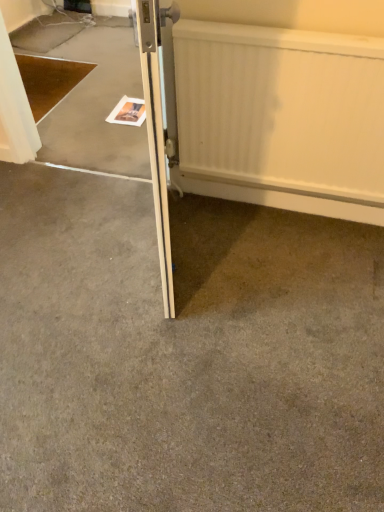
Question: Does gray carpet at center appear on the right side of wooden door at center?

Choices:
 (A) no
 (B) yes

Answer: (A)

Question: Is the position of gray carpet at center less distant than that of wooden door at center?

Choices:
 (A) yes
 (B) no

Answer: (B)

Question: Is gray carpet at center far away from wooden door at center?

Choices:
 (A) yes
 (B) no

Answer: (B)

Question: From the image's perspective, is gray carpet at center located beneath wooden door at center?

Choices:
 (A) no
 (B) yes

Answer: (B)

Question: From the image's perspective, is gray carpet at center over wooden door at center?

Choices:
 (A) no
 (B) yes

Answer: (A)

Question: From a real-world perspective, is gray carpet at center located higher than wooden door at center?

Choices:
 (A) yes
 (B) no

Answer: (B)

Question: Is the position of white textured radiator at upper right less distant than that of wooden door at center?

Choices:
 (A) yes
 (B) no

Answer: (B)

Question: Considering the relative sizes of white textured radiator at upper right and wooden door at center in the image provided, is white textured radiator at upper right taller than wooden door at center?

Choices:
 (A) no
 (B) yes

Answer: (A)

Question: From the image's perspective, would you say white textured radiator at upper right is positioned over wooden door at center?

Choices:
 (A) no
 (B) yes

Answer: (B)

Question: Is white textured radiator at upper right positioned behind wooden door at center?

Choices:
 (A) no
 (B) yes

Answer: (B)

Question: Could you tell me if white textured radiator at upper right is turned towards wooden door at center?

Choices:
 (A) no
 (B) yes

Answer: (B)

Question: Is white textured radiator at upper right not within wooden door at center?

Choices:
 (A) no
 (B) yes

Answer: (B)

Question: Considering the relative sizes of wooden door at center and white textured radiator at upper right in the image provided, is wooden door at center wider than white textured radiator at upper right?

Choices:
 (A) yes
 (B) no

Answer: (A)